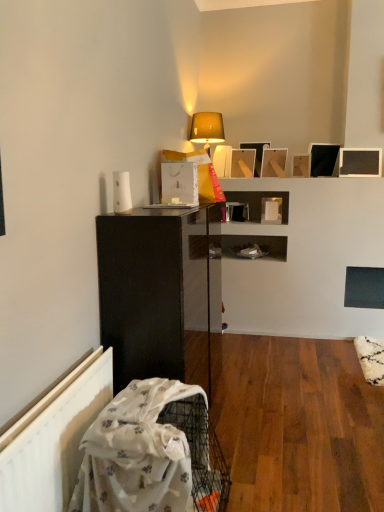
Question: From a real-world perspective, is matte black cabinet at left above or below white plastic radiator at lower left?

Choices:
 (A) below
 (B) above

Answer: (B)

Question: From the image's perspective, is matte black cabinet at left above or below white plastic radiator at lower left?

Choices:
 (A) below
 (B) above

Answer: (B)

Question: Which of these objects is positioned closest to the matte black picture frame at upper right, which ranks as the 6th picture frame in left-to-right order?

Choices:
 (A) matte beige lampshade at upper center
 (B) white plastic radiator at lower left
 (C) matte silver picture frame at upper center, the 3th picture frame positioned from the left
 (D) matte black picture frame at upper center, marked as the 3th picture frame in a right-to-left arrangement
 (E) matte black cabinet at left

Answer: (D)

Question: Considering the real-world distances, which object is farthest from the matte wooden picture frame at upper center, marked as the 1th picture frame in a left-to-right arrangement?

Choices:
 (A) matte black cabinet at left
 (B) matte beige lampshade at upper center
 (C) matte silver picture frame at upper center, the 3th picture frame positioned from the left
 (D) white plastic radiator at lower left
 (E) matte black picture frame at upper right, which ranks as the 6th picture frame in left-to-right order

Answer: (D)